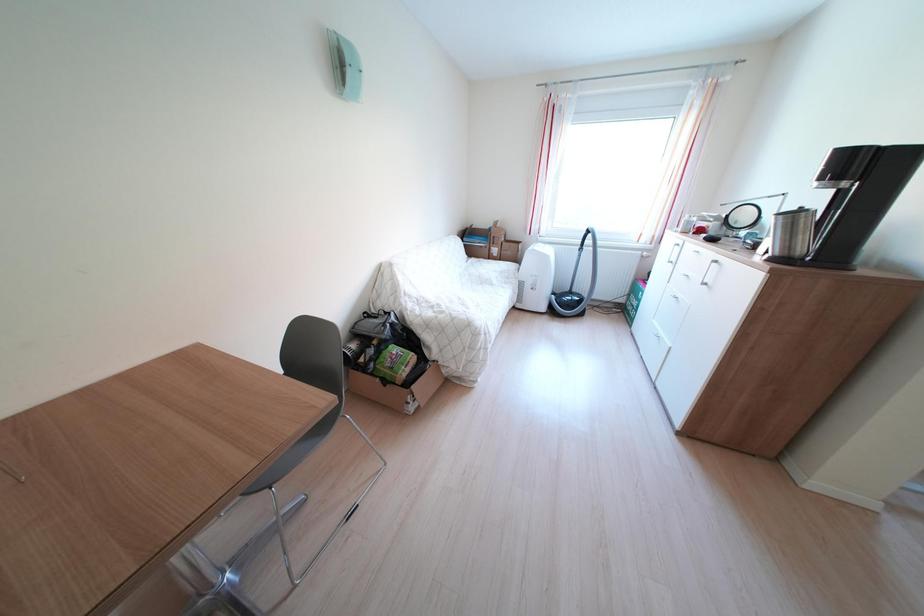
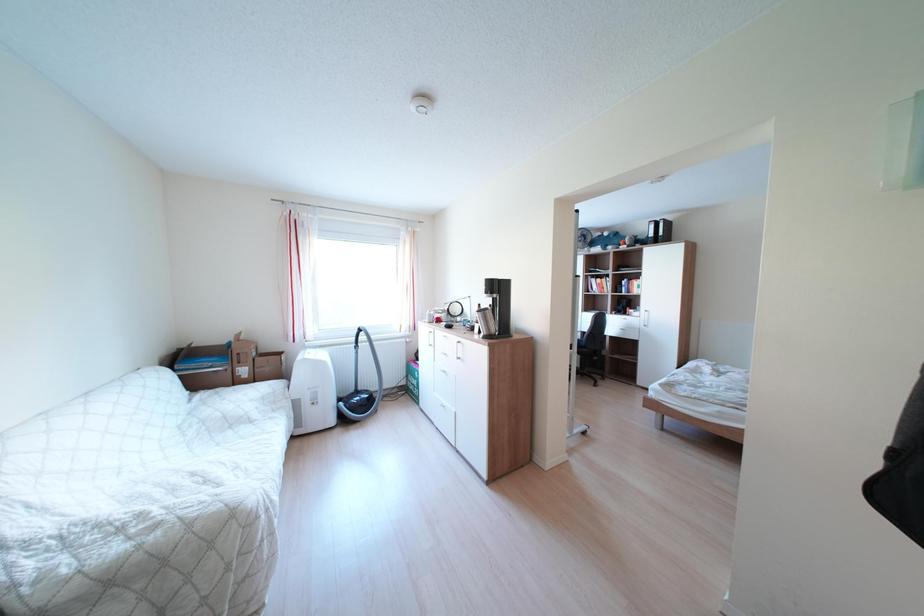
Question: The camera is either moving clockwise (left) or counter-clockwise (right) around the object. The first image is from the beginning of the video and the second image is from the end. Is the camera moving left or right when shooting the video?

Choices:
 (A) Left
 (B) Right

Answer: (A)